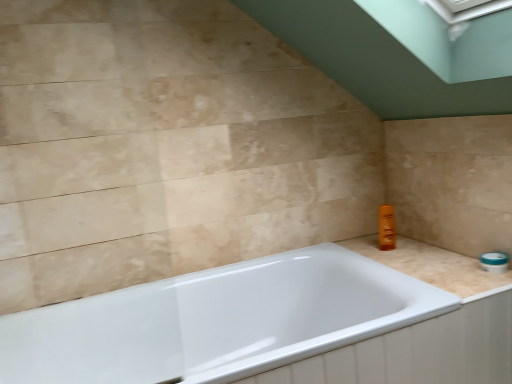
Image resolution: width=512 pixels, height=384 pixels. What are the coordinates of `white glossy bathtub at center` in the screenshot? It's located at (217, 321).

This screenshot has height=384, width=512. Describe the element at coordinates (217, 321) in the screenshot. I see `white glossy bathtub at center` at that location.

Measure the distance between point [218,322] and camera.

Point [218,322] and camera are 5.91 feet apart.

What do you see at coordinates (434, 266) in the screenshot?
I see `beige marble counter top at right` at bounding box center [434, 266].

This screenshot has height=384, width=512. I want to click on beige marble counter top at right, so click(434, 266).

Locate an element on the screen. white glossy bathtub at center is located at coordinates (217, 321).

Can you confirm if white glossy bathtub at center is positioned to the right of beige marble counter top at right?

No, white glossy bathtub at center is not to the right of beige marble counter top at right.

Relative to beige marble counter top at right, is white glossy bathtub at center in front or behind?

Visually, white glossy bathtub at center is located in front of beige marble counter top at right.

Between point (222, 271) and point (426, 250), which one is positioned in front?

Positioned in front is point (426, 250).

From the image's perspective, which object appears higher, white glossy bathtub at center or beige marble counter top at right?

beige marble counter top at right.

From a real-world perspective, which is physically below, white glossy bathtub at center or beige marble counter top at right?

From a 3D spatial view, white glossy bathtub at center is below.

Considering the relative sizes of white glossy bathtub at center and beige marble counter top at right in the image provided, is white glossy bathtub at center wider than beige marble counter top at right?

Yes, white glossy bathtub at center is wider than beige marble counter top at right.

Which of these two, white glossy bathtub at center or beige marble counter top at right, stands taller?

Standing taller between the two is white glossy bathtub at center.

Considering the relative sizes of white glossy bathtub at center and beige marble counter top at right in the image provided, is white glossy bathtub at center bigger than beige marble counter top at right?

Yes.

Choose the correct answer: Is white glossy bathtub at center inside beige marble counter top at right or outside it?

white glossy bathtub at center is not enclosed by beige marble counter top at right.

Is white glossy bathtub at center in contact with beige marble counter top at right?

white glossy bathtub at center and beige marble counter top at right are not in contact.

Is white glossy bathtub at center oriented towards beige marble counter top at right?

No.

How different are the orientations of white glossy bathtub at center and beige marble counter top at right in degrees?

They differ by 89.6 degrees in their facing directions.

Image resolution: width=512 pixels, height=384 pixels. I want to click on counter top that appears above the white glossy bathtub at center (from the image's perspective), so click(434, 266).

Is beige marble counter top at right at the right side of white glossy bathtub at center?

Yes, beige marble counter top at right is to the right of white glossy bathtub at center.

Between beige marble counter top at right and white glossy bathtub at center, which one is positioned in front?

Positioned in front is white glossy bathtub at center.

Considering the points (481, 296) and (403, 309), which point is behind, point (481, 296) or point (403, 309)?

Positioned behind is point (403, 309).

From the image's perspective, who appears lower, beige marble counter top at right or white glossy bathtub at center?

white glossy bathtub at center, from the image's perspective.

From a real-world perspective, does beige marble counter top at right sit lower than white glossy bathtub at center?

Actually, beige marble counter top at right is physically above white glossy bathtub at center in the real world.

Considering the sizes of objects beige marble counter top at right and white glossy bathtub at center in the image provided, who is wider, beige marble counter top at right or white glossy bathtub at center?

Wider between the two is white glossy bathtub at center.

In the scene shown: Can you confirm if beige marble counter top at right is taller than white glossy bathtub at center?

In fact, beige marble counter top at right may be shorter than white glossy bathtub at center.

Considering the sizes of objects beige marble counter top at right and white glossy bathtub at center in the image provided, who is bigger, beige marble counter top at right or white glossy bathtub at center?

Bigger between the two is white glossy bathtub at center.

Is beige marble counter top at right inside or outside of white glossy bathtub at center?

beige marble counter top at right is not inside white glossy bathtub at center, it's outside.

Is beige marble counter top at right far from white glossy bathtub at center?

No, beige marble counter top at right is not far away from white glossy bathtub at center.

Does beige marble counter top at right turn towards white glossy bathtub at center?

Yes, beige marble counter top at right is oriented towards white glossy bathtub at center.

How many degrees apart are the facing directions of beige marble counter top at right and white glossy bathtub at center?

They differ by 89.6 degrees in their facing directions.

Image resolution: width=512 pixels, height=384 pixels. I want to click on bathtub lying on the left of beige marble counter top at right, so click(217, 321).

This screenshot has width=512, height=384. What are the coordinates of `bathtub in front of the beige marble counter top at right` in the screenshot? It's located at (217, 321).

Find the location of a particular element. The height and width of the screenshot is (384, 512). counter top positioned vertically above the white glossy bathtub at center (from a real-world perspective) is located at coordinates (434, 266).